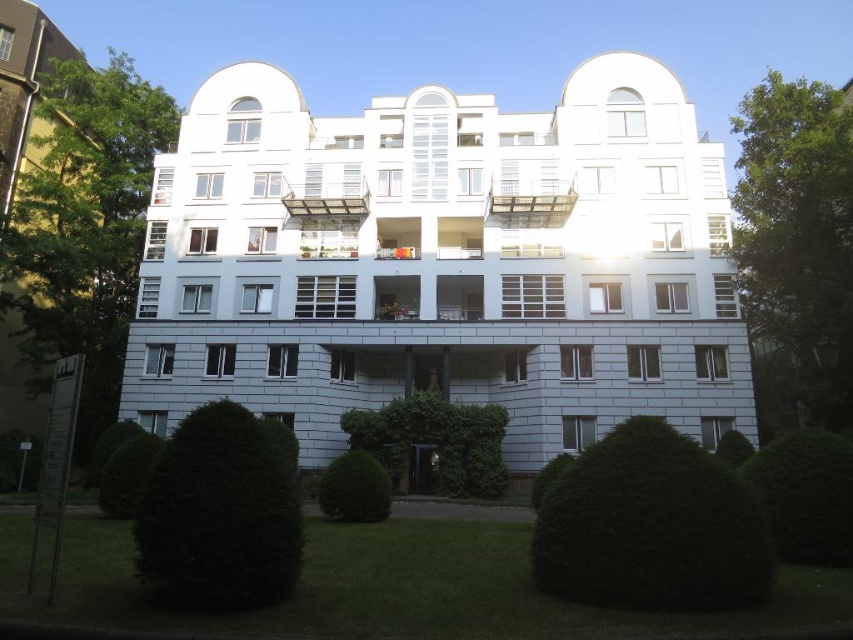
Can you confirm if white stone building at center is shorter than green leafy hedge at lower right?

In fact, white stone building at center may be taller than green leafy hedge at lower right.

Which is more to the left, white stone building at center or green leafy hedge at lower right?

white stone building at center

Image resolution: width=853 pixels, height=640 pixels. What do you see at coordinates (444, 262) in the screenshot?
I see `white stone building at center` at bounding box center [444, 262].

What are the coordinates of `white stone building at center` in the screenshot? It's located at (444, 262).

How far apart are white stone building at center and green textured bush at center?

white stone building at center and green textured bush at center are 7.98 meters apart from each other.

Is point (567, 177) less distant than point (360, 410)?

No, (567, 177) is further to viewer.

The height and width of the screenshot is (640, 853). I want to click on white stone building at center, so (444, 262).

Which is below, dark green leafy bush at lower center or dark green textured bush at lower left?

Positioned lower is dark green textured bush at lower left.

Is dark green leafy bush at lower center in front of dark green textured bush at lower left?

Yes.

Which is in front, point (741, 506) or point (206, 420)?

Point (741, 506) is more forward.

In order to click on dark green leafy bush at lower center in this screenshot , I will do `click(651, 525)`.